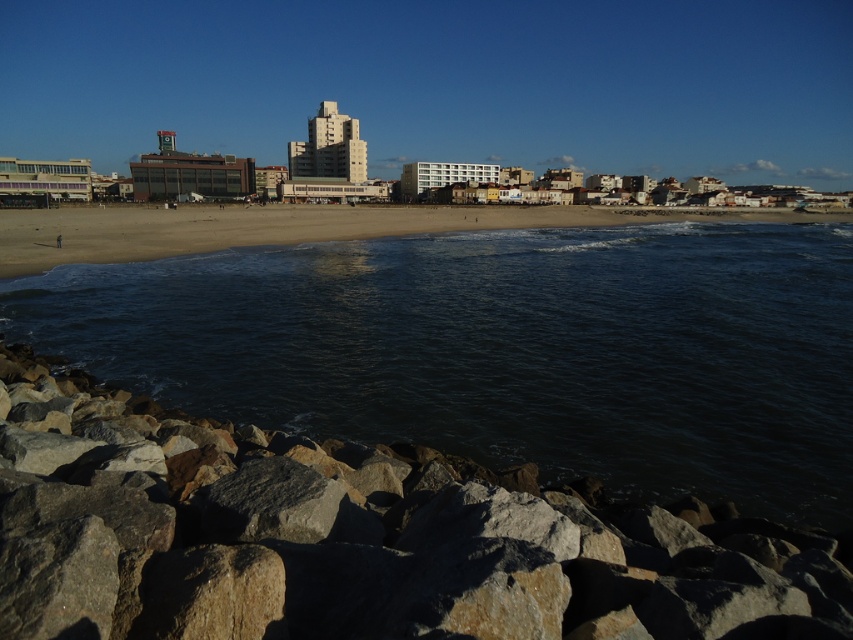
Question: Does dark water at center lie behind smooth sand beach at center?

Choices:
 (A) no
 (B) yes

Answer: (A)

Question: Does dark water at center lie behind smooth sand beach at center?

Choices:
 (A) yes
 (B) no

Answer: (B)

Question: Estimate the real-world distances between objects in this image. Which object is farther from the rough textured rock at lower left?

Choices:
 (A) dark water at center
 (B) smooth sand beach at center

Answer: (B)

Question: Which of the following is the closest to the observer?

Choices:
 (A) (267, 440)
 (B) (56, 248)

Answer: (A)

Question: Which point is farther from the camera taking this photo?

Choices:
 (A) (115, 372)
 (B) (755, 588)
 (C) (30, 250)

Answer: (C)

Question: Is dark water at center to the right of rough textured rock at lower left from the viewer's perspective?

Choices:
 (A) yes
 (B) no

Answer: (A)